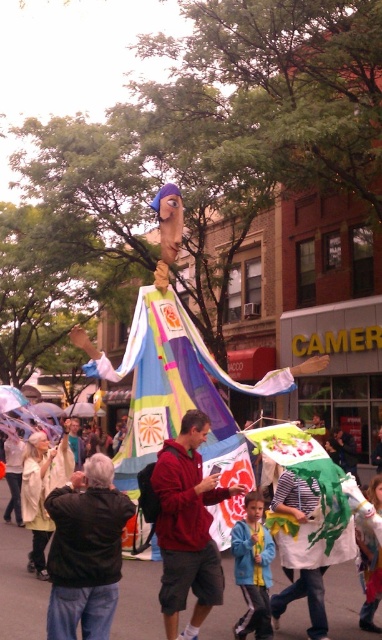
Question: Among these points, which one is nearest to the camera?

Choices:
 (A) (304, 611)
 (B) (241, 563)

Answer: (B)

Question: Is matte black jacket at center above matte red hoodie at center?

Choices:
 (A) no
 (B) yes

Answer: (A)

Question: Is black leather jacket at lower left smaller than matte red hoodie at center?

Choices:
 (A) yes
 (B) no

Answer: (A)

Question: Which is nearer to the black leather jacket at lower left?

Choices:
 (A) blue denim jacket at center
 (B) matte black jacket at center

Answer: (A)

Question: Is the position of black leather jacket at lower left more distant than that of matte red hoodie at center?

Choices:
 (A) yes
 (B) no

Answer: (B)

Question: Which is farther from the black leather jacket at lower left?

Choices:
 (A) matte black jacket at center
 (B) matte red hoodie at center
 (C) blue denim jacket at center

Answer: (A)